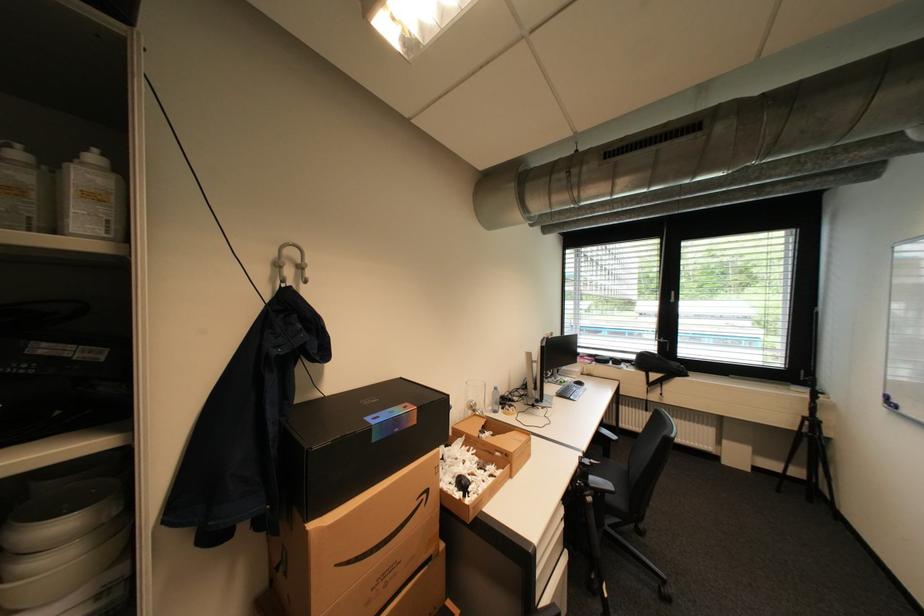
Find where to lift the glass cup. Please return your answer as a coordinate pair (x, y).

(476, 397)